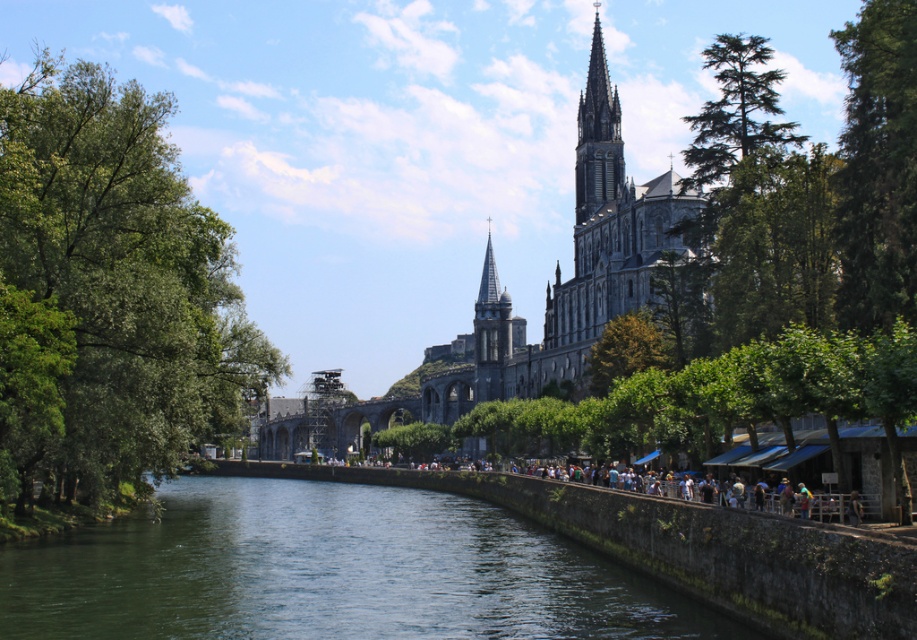
Who is positioned more to the right, greenish water at center or green needle-like foliage at upper right?

Positioned to the right is green needle-like foliage at upper right.

Can you confirm if greenish water at center is positioned above green needle-like foliage at upper right?

No, greenish water at center is not above green needle-like foliage at upper right.

In order to click on greenish water at center in this screenshot , I will do `click(330, 572)`.

Can you confirm if green leafy tree at left is taller than gray stone church at center?

Indeed, green leafy tree at left has a greater height compared to gray stone church at center.

Identify the location of green leafy tree at left. The height and width of the screenshot is (640, 917). (109, 292).

Between point (583, 321) and point (766, 40), which one is positioned behind?

The point (583, 321) is more distant.

Who is more forward, (588, 227) or (704, 120)?

Point (704, 120)

Image resolution: width=917 pixels, height=640 pixels. Describe the element at coordinates (555, 282) in the screenshot. I see `gray stone church at center` at that location.

Locate an element on the screen. gray stone church at center is located at coordinates (555, 282).